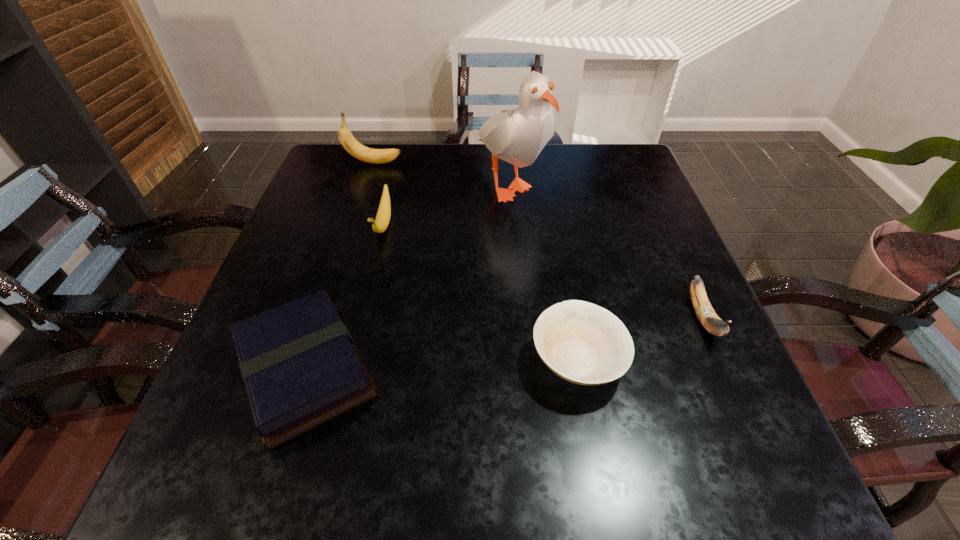
At what (x,y) coordinates should I click in order to perform the action: click on object identified as the fifth closest to the bowl. Please return your answer as a coordinate pair (x, y). Looking at the image, I should click on (376, 156).

At what (x,y) coordinates should I click in order to perform the action: click on banana identified as the closest to the book. Please return your answer as a coordinate pair (x, y). Looking at the image, I should click on (380, 224).

The image size is (960, 540). I want to click on the second closest banana to the second nearest banana, so click(x=709, y=319).

You are a GUI agent. You are given a task and a screenshot of the screen. Output one action in this format:
    pyautogui.click(x=<x>, y=<y>)
    Task: Click on the free space that satisfies the following two spatial constraints: 1. at the start of the peel on the farthest banana; 2. on the front side of the book
    The width and height of the screenshot is (960, 540).
    Given the screenshot: What is the action you would take?
    pyautogui.click(x=309, y=370)

I want to click on vacant space that satisfies the following two spatial constraints: 1. at the stem of the second farthest banana; 2. on the right side of the bowl, so click(x=351, y=361).